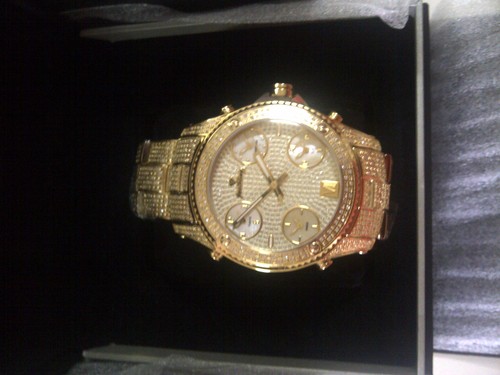
The width and height of the screenshot is (500, 375). I want to click on table/counter, so click(191, 346).